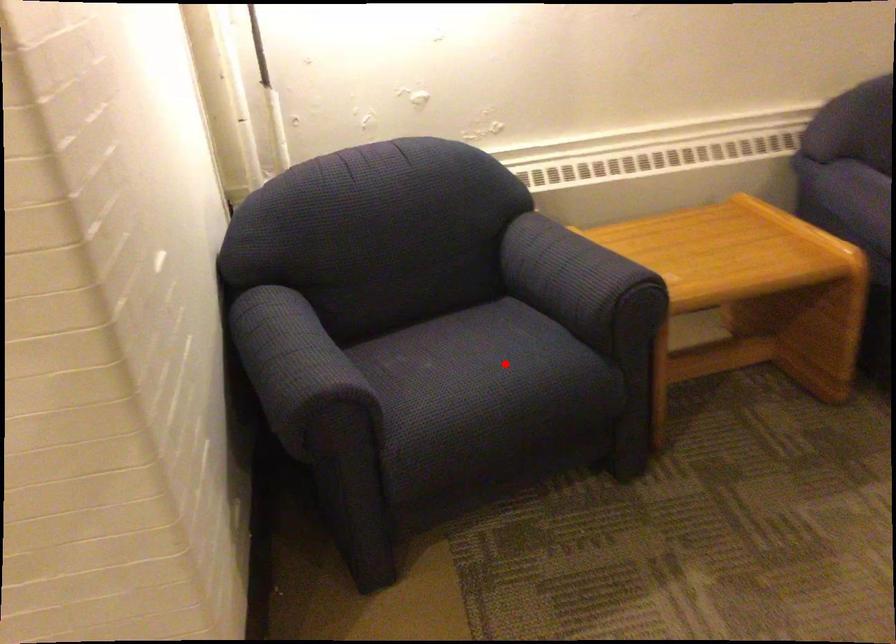
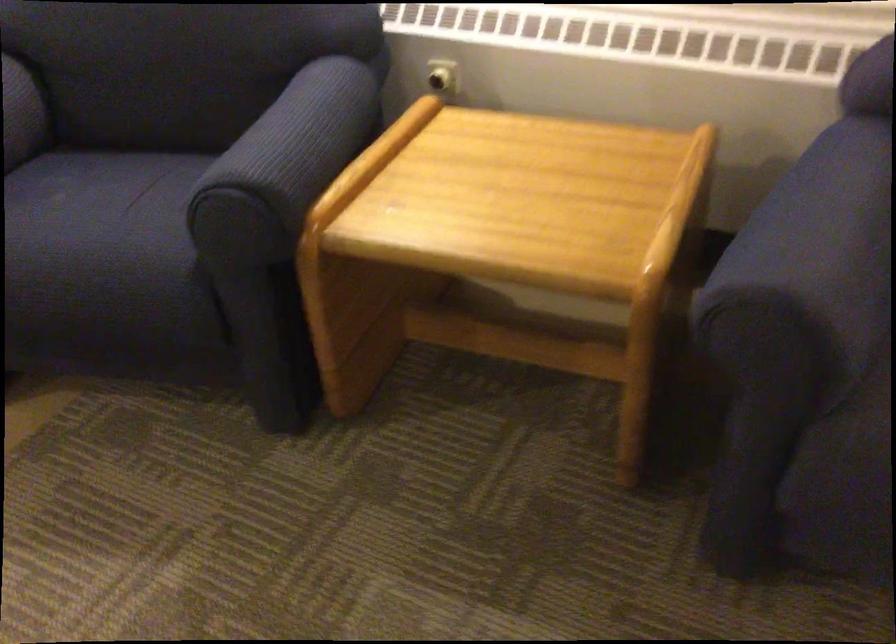
Find the pixel in the second image that matches the highlighted location in the first image.

(99, 232)